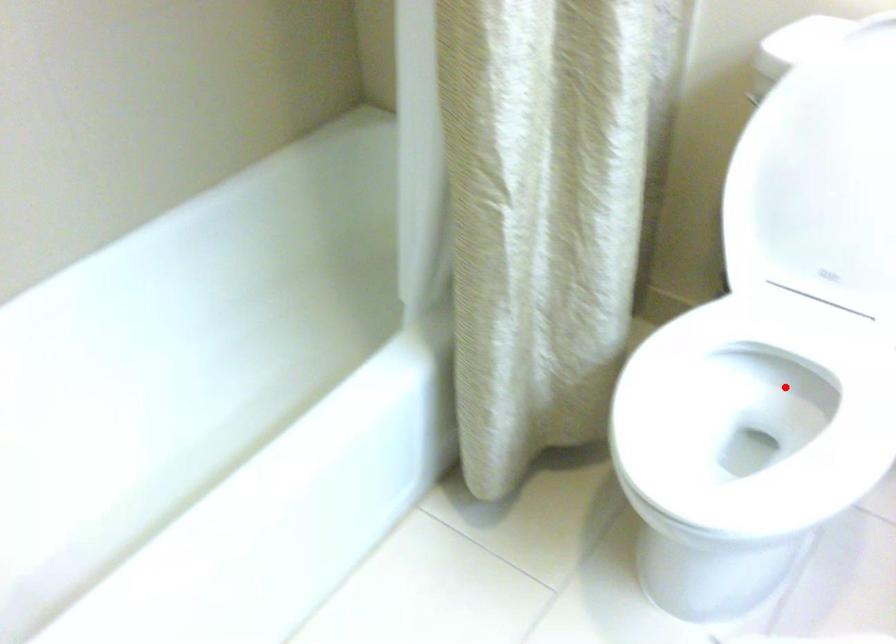
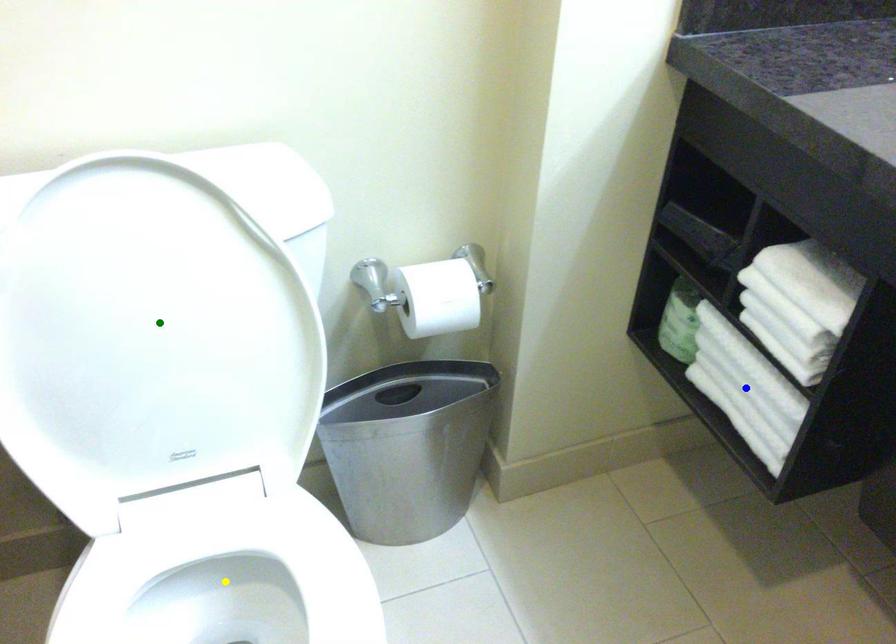
Question: I am providing you with two images of the same scene from different viewpoints. A red point is marked on the first image. You are given multiple points on the second image. Which spot in image 2 lines up with the point in image 1?

Choices:
 (A) yellow point
 (B) green point
 (C) blue point

Answer: (A)